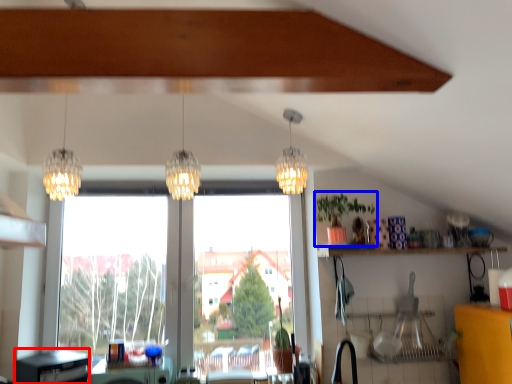
Question: Which object is further to the camera taking this photo, dish washer (highlighted by a red box) or houseplant (highlighted by a blue box)?

Choices:
 (A) dish washer
 (B) houseplant

Answer: (B)